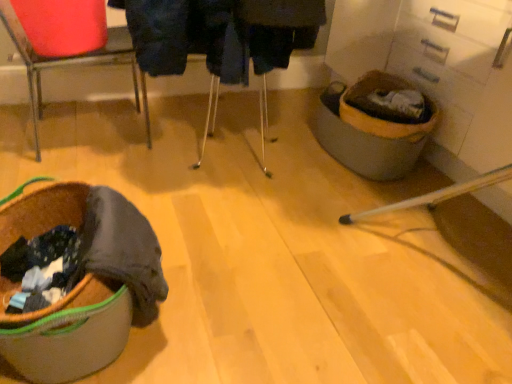
Question: From a real-world perspective, relative to brown fabric laundry basket at lower left, is metallic red chair at upper left vertically above or below?

Choices:
 (A) above
 (B) below

Answer: (A)

Question: Is metallic red chair at upper left wider or thinner than brown fabric laundry basket at lower left?

Choices:
 (A) thin
 (B) wide

Answer: (A)

Question: Would you say metallic red chair at upper left is to the left or to the right of brown fabric laundry basket at lower left in the picture?

Choices:
 (A) left
 (B) right

Answer: (A)

Question: Is brown fabric laundry basket at lower left situated inside metallic red chair at upper left or outside?

Choices:
 (A) outside
 (B) inside

Answer: (A)

Question: Considering the relative positions of brown fabric laundry basket at lower left and metallic red chair at upper left in the image provided, is brown fabric laundry basket at lower left to the left or to the right of metallic red chair at upper left?

Choices:
 (A) left
 (B) right

Answer: (B)

Question: Looking at the image, does brown fabric laundry basket at lower left seem bigger or smaller compared to metallic red chair at upper left?

Choices:
 (A) small
 (B) big

Answer: (A)

Question: In terms of height, does brown fabric laundry basket at lower left look taller or shorter compared to metallic red chair at upper left?

Choices:
 (A) tall
 (B) short

Answer: (B)